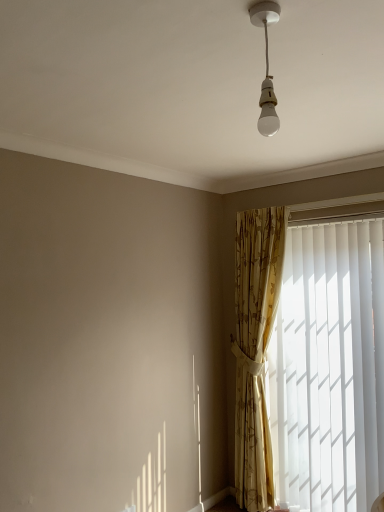
Question: From a real-world perspective, relative to white glossy bulb at upper center, is white vertical blinds at right vertically above or below?

Choices:
 (A) below
 (B) above

Answer: (A)

Question: From the image's perspective, is white vertical blinds at right located above or below white glossy bulb at upper center?

Choices:
 (A) above
 (B) below

Answer: (B)

Question: Which object is positioned closest to the white glossy bulb at upper center?

Choices:
 (A) gold floral fabric curtain at right
 (B) white vertical blinds at right

Answer: (B)

Question: Based on their relative distances, which object is farther from the gold floral fabric curtain at right?

Choices:
 (A) white vertical blinds at right
 (B) white glossy bulb at upper center

Answer: (B)